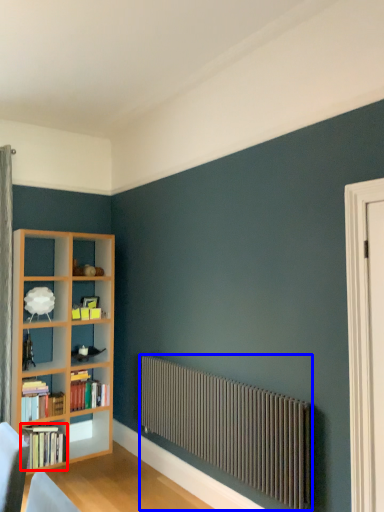
Question: Which object is further to the camera taking this photo, book (highlighted by a red box) or radiator (highlighted by a blue box)?

Choices:
 (A) book
 (B) radiator

Answer: (A)